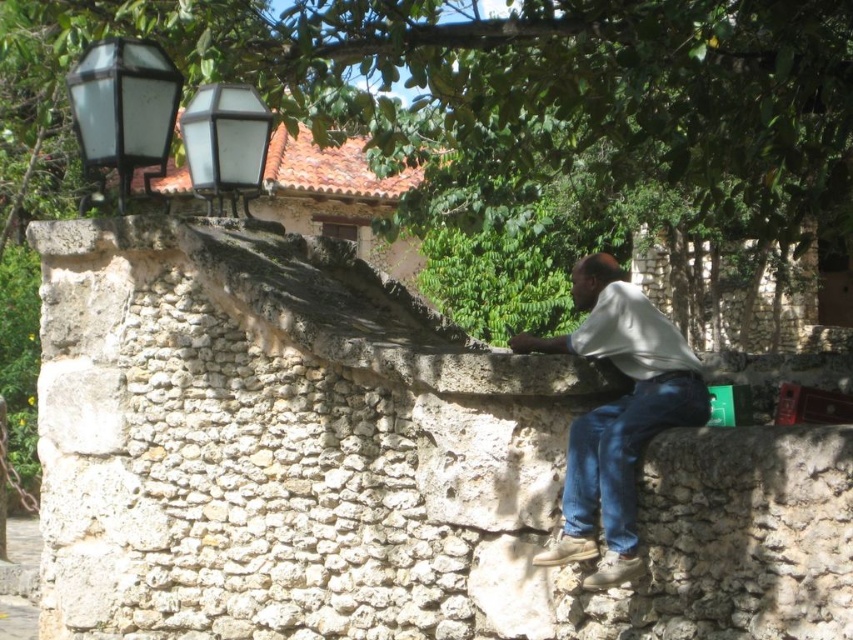
Question: Which object is closer to the camera taking this photo?

Choices:
 (A) white rough stone at center
 (B) blue denim jeans at lower right
 (C) clear glass lantern at upper left
 (D) matte glass lamp post at upper left

Answer: (A)

Question: In this image, where is white cotton shirt at center located relative to clear glass lantern at upper left?

Choices:
 (A) left
 (B) right

Answer: (B)

Question: Can you confirm if blue denim jeans at lower right is positioned to the left of clear glass lantern at upper left?

Choices:
 (A) no
 (B) yes

Answer: (A)

Question: Which of the following is the farthest from the observer?

Choices:
 (A) (90, 168)
 (B) (231, 170)
 (C) (614, 516)
 (D) (310, 474)

Answer: (B)

Question: Can you confirm if white cotton shirt at center is bigger than matte glass lamp post at upper left?

Choices:
 (A) yes
 (B) no

Answer: (B)

Question: Which point is farther from the camera taking this photo?

Choices:
 (A) (634, 508)
 (B) (167, 525)
 (C) (672, 387)

Answer: (B)